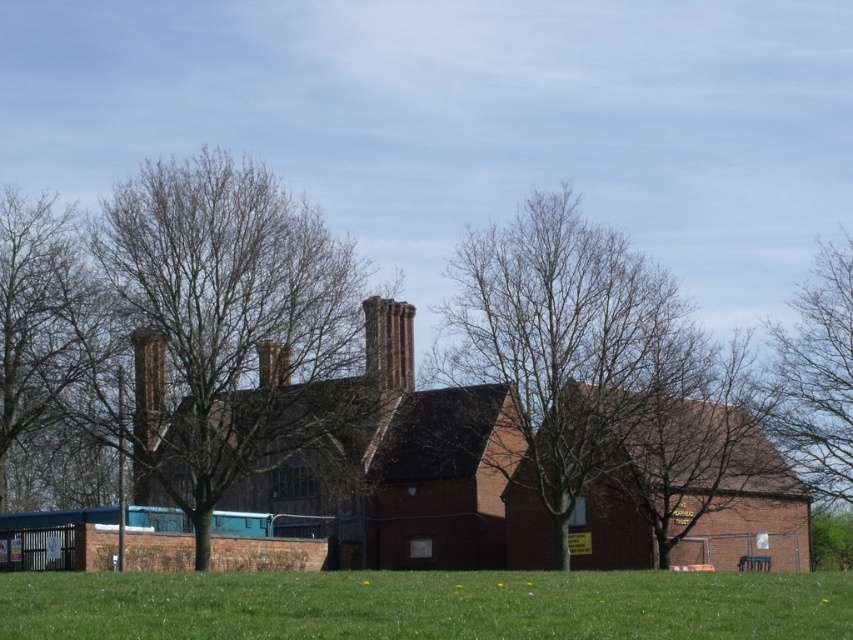
Question: Among these points, which one is nearest to the camera?

Choices:
 (A) (273, 349)
 (B) (273, 627)

Answer: (B)

Question: Can you confirm if bare wood tree at center is smaller than bare branches at right?

Choices:
 (A) no
 (B) yes

Answer: (B)

Question: Estimate the real-world distances between objects in this image. Which object is closer to the rustic brick chimney at center?

Choices:
 (A) bare branches at left
 (B) smooth brick chimney at center-left

Answer: (B)

Question: Does green grass at lower center have a lesser width compared to bare branches at center?

Choices:
 (A) no
 (B) yes

Answer: (A)

Question: Which is nearer to the bare branches at center?

Choices:
 (A) rustic brick chimney at center
 (B) smooth brick chimney at center-left

Answer: (A)

Question: Observing the image, what is the correct spatial positioning of bare wood tree at center in reference to smooth brick chimney at center-left?

Choices:
 (A) left
 (B) right

Answer: (B)